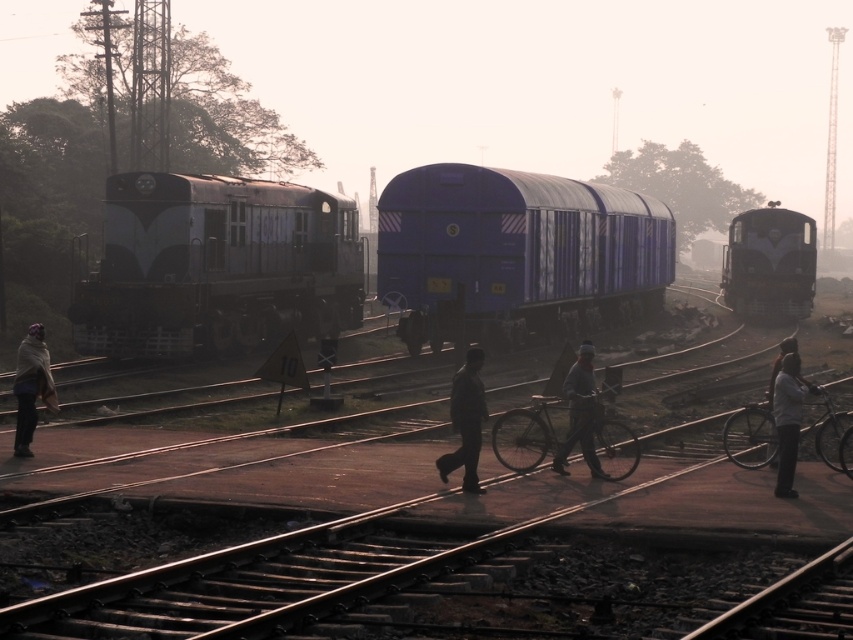
You are standing at point (18,408) and want to walk to point (202,275). Based on the railway scene described, will you have to walk towards the locomotive or away from it?

Point (202,275) is behind point (18,408). Since you are at point (18,408) and want to go to point (202,275), you will be walking towards the locomotive as it is in the left direction of the scene.

You are a photographer trying to capture the gray knit cap at center in your shot. Based on the coordinates provided, where should you focus your camera to ensure the cap is in the center of the image?

The gray knit cap at center is located at coordinates point (x=579, y=413), so you should focus your camera there to center it in the image.

You are a pedestrian trying to cross the railway tracks. You see the matte black train at left and the matte gray scarf at left. Which object is closer to you?

The matte gray scarf at left is behind the matte black train at left, so the matte black train at left is closer to you.